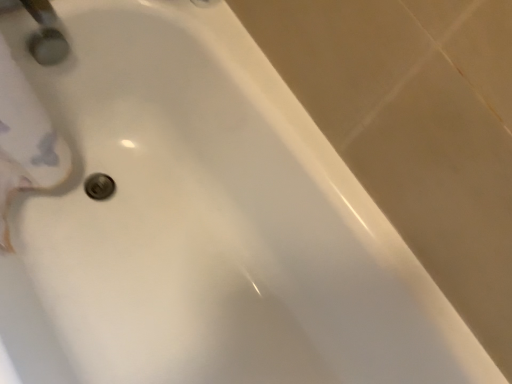
What do you see at coordinates (46, 34) in the screenshot? I see `satin nickel faucet at upper left` at bounding box center [46, 34].

This screenshot has width=512, height=384. What are the coordinates of `satin nickel faucet at upper left` in the screenshot? It's located at (46, 34).

You are a GUI agent. You are given a task and a screenshot of the screen. Output one action in this format:
    pyautogui.click(x=<x>, y=<y>)
    Task: Click on the satin nickel faucet at upper left
    This screenshot has height=384, width=512.
    Given the screenshot: What is the action you would take?
    pyautogui.click(x=46, y=34)